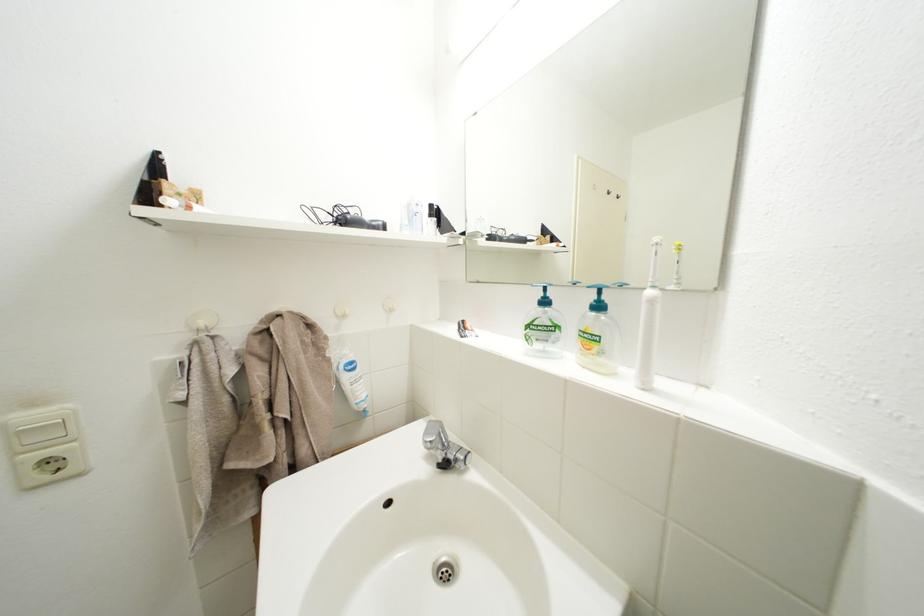
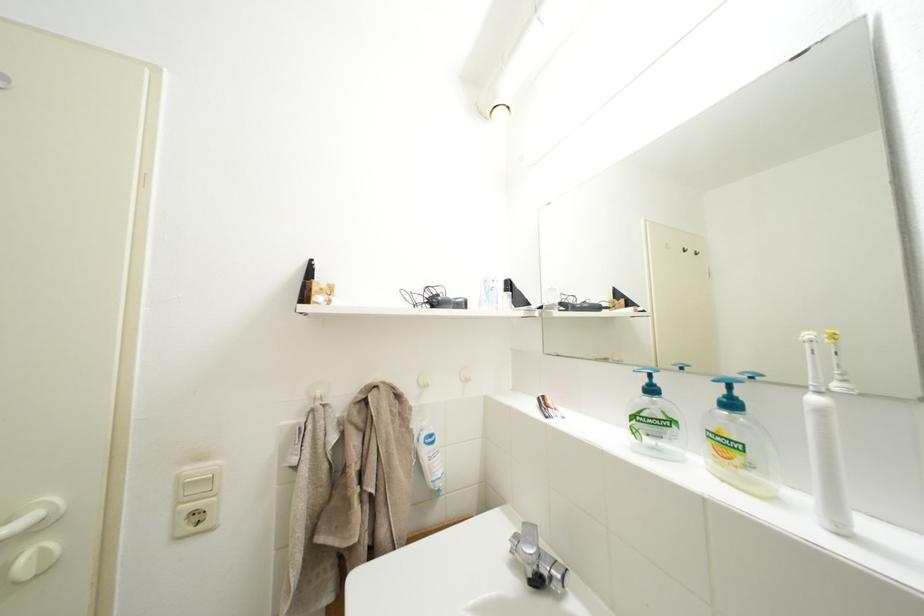
The point at (416, 228) is marked in the first image. Where is the corresponding point in the second image?

(493, 302)